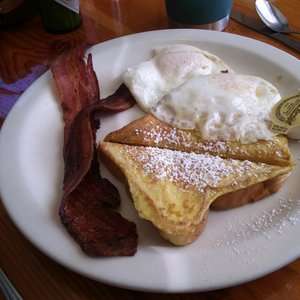
Image resolution: width=300 pixels, height=300 pixels. I want to click on butter knife, so click(254, 23).